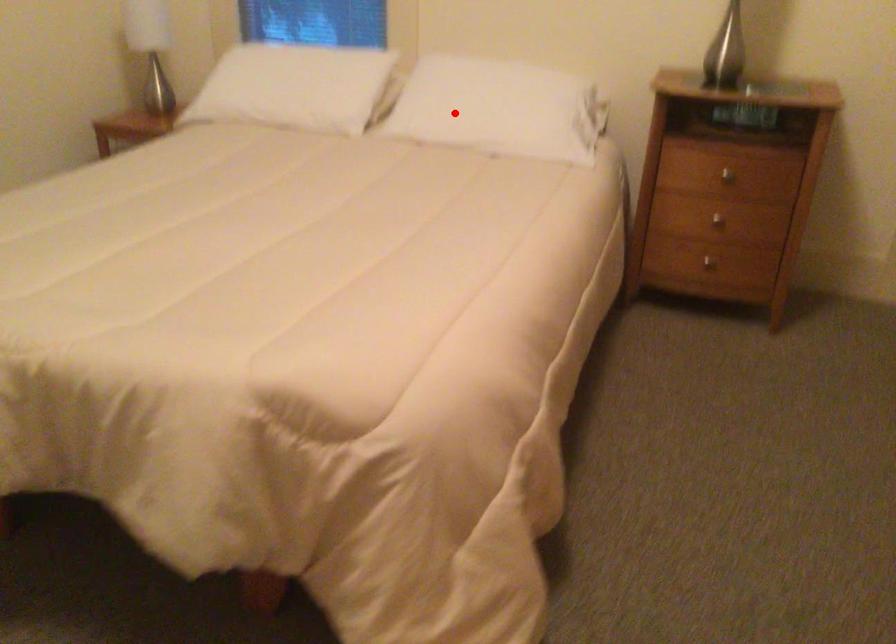
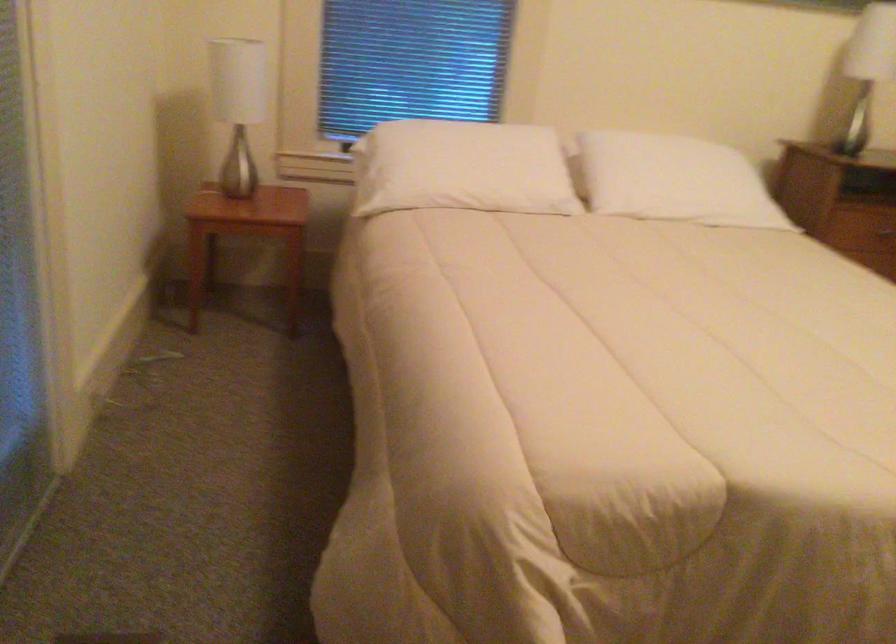
Locate, in the second image, the point that corresponds to the highlighted location in the first image.

(673, 180)